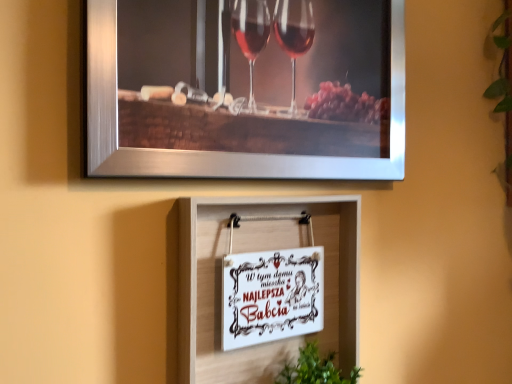
Where is `metallic silver picture frame at upper center, the 1th picture frame viewed from the top`? The height and width of the screenshot is (384, 512). metallic silver picture frame at upper center, the 1th picture frame viewed from the top is located at coordinates (246, 89).

What is the approximate height of white paper sign at center, which is the second picture frame from top to bottom?

white paper sign at center, which is the second picture frame from top to bottom, is 5.45 inches in height.

Looking at this image, in order to face white paper sign at center, which is the second picture frame from top to bottom, should I rotate leftwards or rightwards?

You should rotate right by 3.073 degrees.

The image size is (512, 384). What do you see at coordinates (255, 251) in the screenshot?
I see `white paper sign at center, the 1th picture frame in the bottom-to-top sequence` at bounding box center [255, 251].

You are a GUI agent. You are given a task and a screenshot of the screen. Output one action in this format:
    pyautogui.click(x=<x>, y=<y>)
    Task: Click on the metallic silver picture frame at upper center, the 1th picture frame viewed from the top
    
    Given the screenshot: What is the action you would take?
    (246, 89)

From the image's perspective, who appears lower, metallic silver picture frame at upper center, positioned as the third picture frame in bottom-to-top order, or green leafy plant at lower center?

green leafy plant at lower center, from the image's perspective.

In terms of height, does metallic silver picture frame at upper center, the 1th picture frame viewed from the top, look taller or shorter compared to green leafy plant at lower center?

Clearly, metallic silver picture frame at upper center, the 1th picture frame viewed from the top, is taller compared to green leafy plant at lower center.

From a real-world perspective, which is physically above, metallic silver picture frame at upper center, positioned as the third picture frame in bottom-to-top order, or green leafy plant at lower center?

metallic silver picture frame at upper center, positioned as the third picture frame in bottom-to-top order, is physically above.

Considering their positions, is metallic silver picture frame at upper center, the 1th picture frame viewed from the top, located in front of or behind white paper sign at center, which appears as the 2th picture frame when ordered from the bottom?

metallic silver picture frame at upper center, the 1th picture frame viewed from the top, is positioned closer to the viewer than white paper sign at center, which appears as the 2th picture frame when ordered from the bottom.

Looking at this image, who is smaller, metallic silver picture frame at upper center, the 1th picture frame viewed from the top, or white paper sign at center, which is the second picture frame from top to bottom?

With smaller size is white paper sign at center, which is the second picture frame from top to bottom.

What's the angular difference between metallic silver picture frame at upper center, the 1th picture frame viewed from the top, and white paper sign at center, which is the second picture frame from top to bottom,'s facing directions?

They differ by 0.86 degrees in their facing directions.

Looking at this image, is metallic silver picture frame at upper center, the 1th picture frame viewed from the top, positioned far away from white paper sign at center, which is the second picture frame from top to bottom?

No.

Consider the image. Would you say metallic silver picture frame at upper center, the 1th picture frame viewed from the top, is part of white paper sign at center, which is the second picture frame from top to bottom,'s contents?

Actually, metallic silver picture frame at upper center, the 1th picture frame viewed from the top, is outside white paper sign at center, which is the second picture frame from top to bottom.

Could you tell me if white paper sign at center, which appears as the 2th picture frame when ordered from the bottom, is facing metallic silver picture frame at upper center, positioned as the third picture frame in bottom-to-top order?

No, white paper sign at center, which appears as the 2th picture frame when ordered from the bottom, is not turned towards metallic silver picture frame at upper center, positioned as the third picture frame in bottom-to-top order.

From a real-world perspective, between white paper sign at center, which appears as the 2th picture frame when ordered from the bottom, and metallic silver picture frame at upper center, the 1th picture frame viewed from the top, who is vertically higher?

From a 3D spatial view, metallic silver picture frame at upper center, the 1th picture frame viewed from the top, is above.

Is white paper sign at center, the 1th picture frame in the bottom-to-top sequence, oriented away from green leafy plant at lower center?

That's right, white paper sign at center, the 1th picture frame in the bottom-to-top sequence, is facing away from green leafy plant at lower center.

Is white paper sign at center, the 1th picture frame in the bottom-to-top sequence, bigger or smaller than green leafy plant at lower center?

In the image, white paper sign at center, the 1th picture frame in the bottom-to-top sequence, appears to be larger than green leafy plant at lower center.

In the scene shown: How many degrees apart are the facing directions of white paper sign at center, marked as the 3th picture frame in a top-to-bottom arrangement, and green leafy plant at lower center?

The facing directions of white paper sign at center, marked as the 3th picture frame in a top-to-bottom arrangement, and green leafy plant at lower center are 3.24 degrees apart.

From a real-world perspective, is metallic silver picture frame at upper center, positioned as the third picture frame in bottom-to-top order, physically above white paper sign at center, marked as the 3th picture frame in a top-to-bottom arrangement?

Indeed, from a real-world perspective, metallic silver picture frame at upper center, positioned as the third picture frame in bottom-to-top order, stands above white paper sign at center, marked as the 3th picture frame in a top-to-bottom arrangement.

Can you confirm if metallic silver picture frame at upper center, the 1th picture frame viewed from the top, is smaller than white paper sign at center, marked as the 3th picture frame in a top-to-bottom arrangement?

Actually, metallic silver picture frame at upper center, the 1th picture frame viewed from the top, might be larger than white paper sign at center, marked as the 3th picture frame in a top-to-bottom arrangement.

Which is behind, metallic silver picture frame at upper center, positioned as the third picture frame in bottom-to-top order, or white paper sign at center, marked as the 3th picture frame in a top-to-bottom arrangement?

white paper sign at center, marked as the 3th picture frame in a top-to-bottom arrangement, is behind.

Which is correct: metallic silver picture frame at upper center, the 1th picture frame viewed from the top, is inside white paper sign at center, marked as the 3th picture frame in a top-to-bottom arrangement, or outside of it?

metallic silver picture frame at upper center, the 1th picture frame viewed from the top, is not enclosed by white paper sign at center, marked as the 3th picture frame in a top-to-bottom arrangement.

Who is bigger, white paper sign at center, which is the second picture frame from top to bottom, or green leafy plant at lower center?

Bigger between the two is green leafy plant at lower center.

Between white paper sign at center, which is the second picture frame from top to bottom, and green leafy plant at lower center, which one has larger width?

green leafy plant at lower center is wider.

Locate an element on the screen. the 3rd picture frame counting from the left side of the green leafy plant at lower center is located at coordinates (271, 296).

Is white paper sign at center, which appears as the 2th picture frame when ordered from the bottom, not inside green leafy plant at lower center?

white paper sign at center, which appears as the 2th picture frame when ordered from the bottom, is positioned outside green leafy plant at lower center.

How many degrees apart are the facing directions of white paper sign at center, marked as the 3th picture frame in a top-to-bottom arrangement, and metallic silver picture frame at upper center, positioned as the third picture frame in bottom-to-top order?

white paper sign at center, marked as the 3th picture frame in a top-to-bottom arrangement, and metallic silver picture frame at upper center, positioned as the third picture frame in bottom-to-top order, are facing 0.852 degrees away from each other.

Is white paper sign at center, marked as the 3th picture frame in a top-to-bottom arrangement, at the left side of metallic silver picture frame at upper center, the 1th picture frame viewed from the top?

Indeed, white paper sign at center, marked as the 3th picture frame in a top-to-bottom arrangement, is positioned on the left side of metallic silver picture frame at upper center, the 1th picture frame viewed from the top.

Is there a large distance between white paper sign at center, the 1th picture frame in the bottom-to-top sequence, and metallic silver picture frame at upper center, the 1th picture frame viewed from the top?

No, white paper sign at center, the 1th picture frame in the bottom-to-top sequence, is not far from metallic silver picture frame at upper center, the 1th picture frame viewed from the top.

Consider the image. Considering the relative sizes of white paper sign at center, the 1th picture frame in the bottom-to-top sequence, and metallic silver picture frame at upper center, positioned as the third picture frame in bottom-to-top order, in the image provided, is white paper sign at center, the 1th picture frame in the bottom-to-top sequence, smaller than metallic silver picture frame at upper center, positioned as the third picture frame in bottom-to-top order,?

Indeed, white paper sign at center, the 1th picture frame in the bottom-to-top sequence, has a smaller size compared to metallic silver picture frame at upper center, positioned as the third picture frame in bottom-to-top order.

The height and width of the screenshot is (384, 512). Find the location of `picture frame that is the 1st one when counting leftward from the green leafy plant at lower center`. picture frame that is the 1st one when counting leftward from the green leafy plant at lower center is located at coordinates (246, 89).

Where is `the 1st picture frame positioned below the metallic silver picture frame at upper center, the 1th picture frame viewed from the top (from a real-world perspective)`? the 1st picture frame positioned below the metallic silver picture frame at upper center, the 1th picture frame viewed from the top (from a real-world perspective) is located at coordinates (271, 296).

Which object lies further to the anchor point green leafy plant at lower center, white paper sign at center, the 1th picture frame in the bottom-to-top sequence, or white paper sign at center, which appears as the 2th picture frame when ordered from the bottom?

white paper sign at center, the 1th picture frame in the bottom-to-top sequence, is positioned further to the anchor green leafy plant at lower center.

Estimate the real-world distances between objects in this image. Which object is further from metallic silver picture frame at upper center, the 1th picture frame viewed from the top, white paper sign at center, marked as the 3th picture frame in a top-to-bottom arrangement, or green leafy plant at lower center?

green leafy plant at lower center.

Estimate the real-world distances between objects in this image. Which object is closer to green leafy plant at lower center, metallic silver picture frame at upper center, the 1th picture frame viewed from the top, or white paper sign at center, which appears as the 2th picture frame when ordered from the bottom?

The object closer to green leafy plant at lower center is white paper sign at center, which appears as the 2th picture frame when ordered from the bottom.

Considering their positions, is white paper sign at center, which is the second picture frame from top to bottom, positioned closer to metallic silver picture frame at upper center, the 1th picture frame viewed from the top, than green leafy plant at lower center?

The object closer to metallic silver picture frame at upper center, the 1th picture frame viewed from the top, is white paper sign at center, which is the second picture frame from top to bottom.

Which object lies nearer to the anchor point white paper sign at center, which is the second picture frame from top to bottom, metallic silver picture frame at upper center, positioned as the third picture frame in bottom-to-top order, or white paper sign at center, marked as the 3th picture frame in a top-to-bottom arrangement?

white paper sign at center, marked as the 3th picture frame in a top-to-bottom arrangement, is closer to white paper sign at center, which is the second picture frame from top to bottom.

Based on their spatial positions, is white paper sign at center, the 1th picture frame in the bottom-to-top sequence, or white paper sign at center, which appears as the 2th picture frame when ordered from the bottom, further from metallic silver picture frame at upper center, positioned as the third picture frame in bottom-to-top order?

The object further to metallic silver picture frame at upper center, positioned as the third picture frame in bottom-to-top order, is white paper sign at center, which appears as the 2th picture frame when ordered from the bottom.

Looking at the image, which one is located further to white paper sign at center, which is the second picture frame from top to bottom, metallic silver picture frame at upper center, the 1th picture frame viewed from the top, or green leafy plant at lower center?

Result: Based on the image, metallic silver picture frame at upper center, the 1th picture frame viewed from the top, appears to be further to white paper sign at center, which is the second picture frame from top to bottom.

Looking at the image, which one is located closer to white paper sign at center, marked as the 3th picture frame in a top-to-bottom arrangement, white paper sign at center, which appears as the 2th picture frame when ordered from the bottom, or green leafy plant at lower center?

white paper sign at center, which appears as the 2th picture frame when ordered from the bottom, lies closer to white paper sign at center, marked as the 3th picture frame in a top-to-bottom arrangement, than the other object.

You are a GUI agent. You are given a task and a screenshot of the screen. Output one action in this format:
    pyautogui.click(x=<x>, y=<y>)
    Task: Click on the picture frame between metallic silver picture frame at upper center, the 1th picture frame viewed from the top, and white paper sign at center, marked as the 3th picture frame in a top-to-bottom arrangement, in the up-down direction
    
    Given the screenshot: What is the action you would take?
    pyautogui.click(x=271, y=296)

At what (x,y) coordinates should I click in order to perform the action: click on picture frame between white paper sign at center, which is the second picture frame from top to bottom, and green leafy plant at lower center from top to bottom. Please return your answer as a coordinate pair (x, y). Looking at the image, I should click on (255, 251).